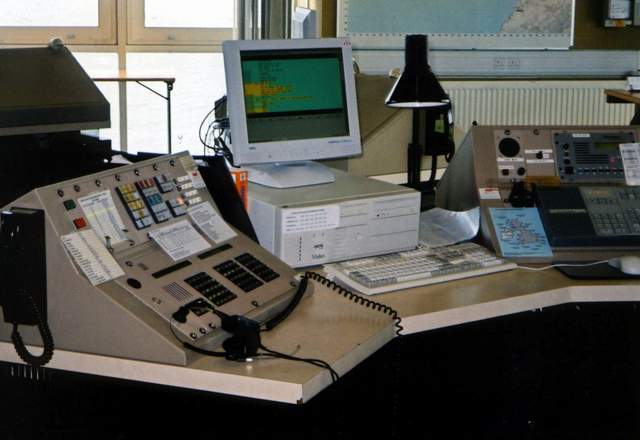
The image size is (640, 440). Identify the location of desk lamp. (418, 94).